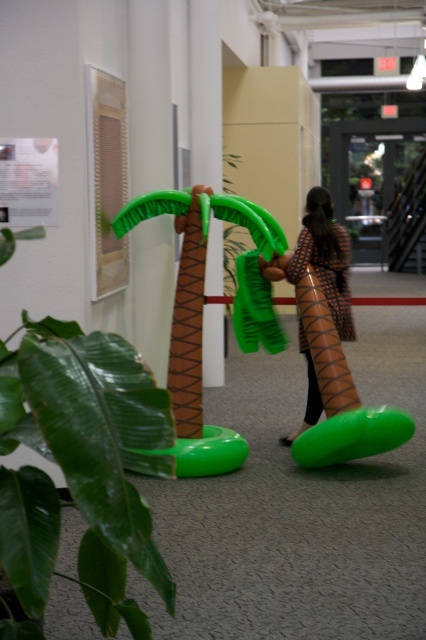
Between green rubber plant at left and brown textured dress at center, which one has more height?

Standing taller between the two is brown textured dress at center.

Is point (94, 369) more distant than point (322, 212)?

No, (94, 369) is closer to viewer.

Which is in front, point (109, 499) or point (313, 260)?

Point (109, 499) is in front.

At what (x,y) coordinates should I click in order to perform the action: click on green rubber plant at left. Please return your answer as a coordinate pair (x, y). This screenshot has width=426, height=640. Looking at the image, I should click on (80, 467).